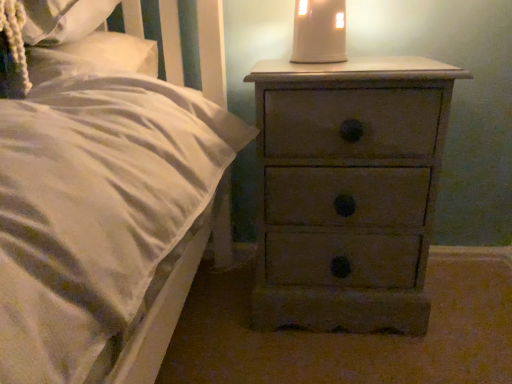
Identify the location of empty space that is ontop of distressed wood chest of drawers at right (from a real-world perspective). Image resolution: width=512 pixels, height=384 pixels. (348, 65).